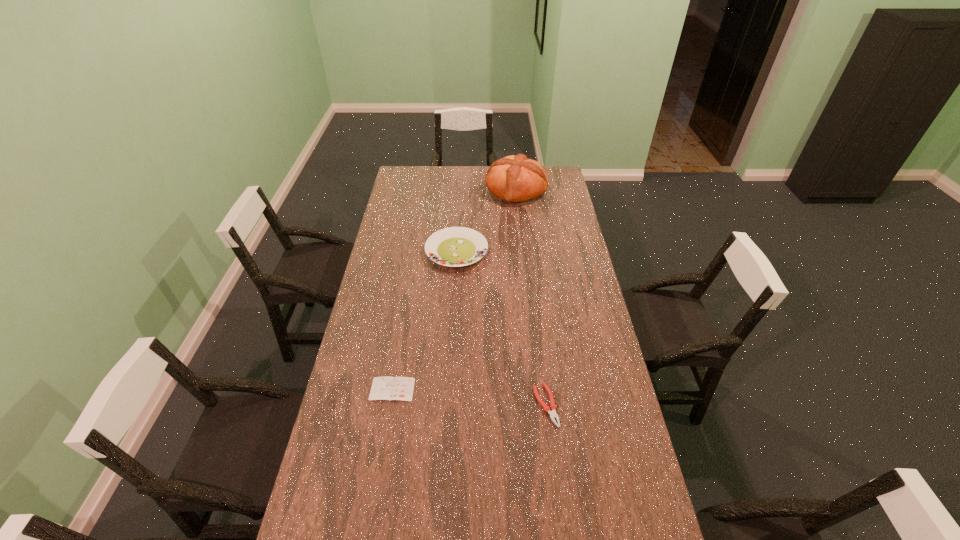
The height and width of the screenshot is (540, 960). I want to click on blank region between the diary and the third tallest object, so click(x=469, y=397).

Image resolution: width=960 pixels, height=540 pixels. In order to click on unoccupied area between the diary and the farthest object in this screenshot , I will do `click(454, 289)`.

Where is `empty space that is in between the farthest object and the shortest object`? empty space that is in between the farthest object and the shortest object is located at coordinates (454, 289).

Where is `free space between the shortest object and the second tallest object`? This screenshot has width=960, height=540. free space between the shortest object and the second tallest object is located at coordinates (424, 320).

This screenshot has width=960, height=540. What are the coordinates of `free spot between the shortest object and the second tallest object` in the screenshot? It's located at (424, 320).

Identify the location of free space between the tallest object and the third nearest object. This screenshot has width=960, height=540. (486, 220).

The image size is (960, 540). I want to click on vacant area that lies between the diary and the bread, so click(454, 289).

Where is `object that is the second nearest to the third shortest object`? The height and width of the screenshot is (540, 960). object that is the second nearest to the third shortest object is located at coordinates (389, 388).

Identify the location of object that is the second closest one to the farthest object. (553, 407).

Find the location of a particular element. The image size is (960, 540). free region that satisfies the following two spatial constraints: 1. on the back side of the second farthest object; 2. on the left side of the bread is located at coordinates (461, 190).